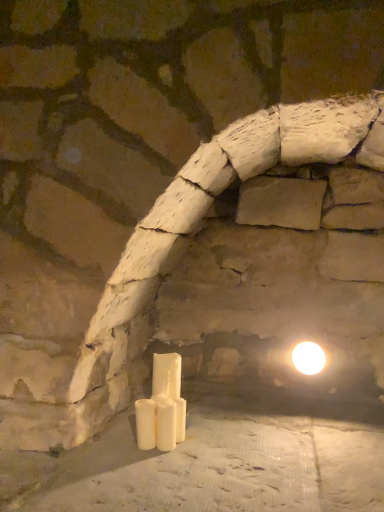
Question: Which direction should I rotate to look at white matte candle at lower center, which is the 2th candle in front-to-back order, — up or down?

Choices:
 (A) up
 (B) down

Answer: (B)

Question: Does white glossy light bulb at upper right have a greater width compared to white matte candle at lower center, the 2th candle when ordered from back to front?

Choices:
 (A) no
 (B) yes

Answer: (B)

Question: Considering the relative positions of white glossy light bulb at upper right and white matte candle at lower center, which is the 2th candle in front-to-back order, in the image provided, is white glossy light bulb at upper right behind white matte candle at lower center, which is the 2th candle in front-to-back order,?

Choices:
 (A) yes
 (B) no

Answer: (A)

Question: Is white glossy light bulb at upper right outside of white matte candle at lower center, the 2th candle when ordered from back to front?

Choices:
 (A) no
 (B) yes

Answer: (B)

Question: Does white glossy light bulb at upper right have a greater height compared to white matte candle at lower center, which is the 2th candle in front-to-back order?

Choices:
 (A) yes
 (B) no

Answer: (B)

Question: Is white glossy light bulb at upper right aimed at white matte candle at lower center, the 2th candle when ordered from back to front?

Choices:
 (A) no
 (B) yes

Answer: (A)

Question: Does white glossy light bulb at upper right have a lesser width compared to white matte candle at lower center, which is the 2th candle in front-to-back order?

Choices:
 (A) no
 (B) yes

Answer: (A)

Question: From a real-world perspective, is white matte candle at center, which is the 3th candle from back to front, below white glossy light bulb at upper right?

Choices:
 (A) yes
 (B) no

Answer: (A)

Question: From a real-world perspective, is white matte candle at center, the first candle viewed from the front, positioned over white glossy light bulb at upper right based on gravity?

Choices:
 (A) no
 (B) yes

Answer: (A)

Question: Is the depth of white matte candle at center, which is the 3th candle from back to front, greater than that of white glossy light bulb at upper right?

Choices:
 (A) no
 (B) yes

Answer: (A)

Question: From the image's perspective, is white matte candle at center, which is the 3th candle from back to front, above white glossy light bulb at upper right?

Choices:
 (A) yes
 (B) no

Answer: (B)

Question: Does white matte candle at center, which is the 3th candle from back to front, appear on the right side of white glossy light bulb at upper right?

Choices:
 (A) yes
 (B) no

Answer: (B)

Question: Does white matte candle at center, which is the 3th candle from back to front, have a lesser height compared to white glossy light bulb at upper right?

Choices:
 (A) no
 (B) yes

Answer: (A)

Question: Is white matte candle at center, which is the 3th candle from back to front, outside of white matte candle at lower center, the 2th candle when ordered from back to front?

Choices:
 (A) no
 (B) yes

Answer: (B)